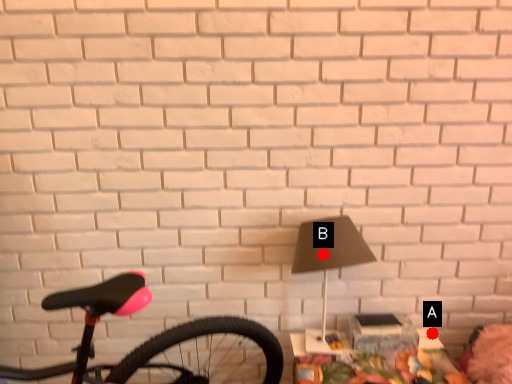
Question: Two points are circled on the image, labeled by A and B beside each circle. Which of the following is the closest to the observer?

Choices:
 (A) A is closer
 (B) B is closer

Answer: (B)